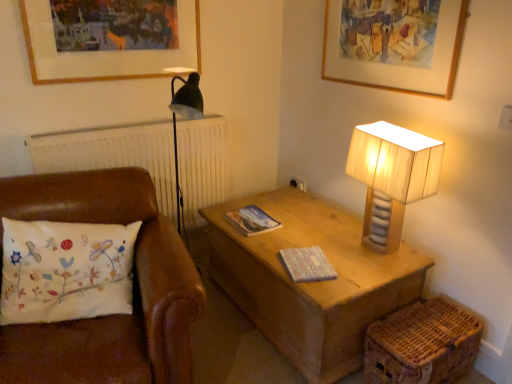
Question: From a real-world perspective, is wooden lampshade at right located higher than wooden textured book at center, the second magazine positioned from the top?

Choices:
 (A) yes
 (B) no

Answer: (A)

Question: Does wooden lampshade at right have a lesser width compared to wooden textured book at center, which ranks as the first magazine in front-to-back order?

Choices:
 (A) no
 (B) yes

Answer: (A)

Question: From the image's perspective, is wooden lampshade at right on top of wooden textured book at center, which is counted as the 2th magazine, starting from the back?

Choices:
 (A) no
 (B) yes

Answer: (B)

Question: Can you confirm if wooden lampshade at right is smaller than wooden textured book at center, which is counted as the 2th magazine, starting from the back?

Choices:
 (A) no
 (B) yes

Answer: (A)

Question: Is wooden lampshade at right taller than wooden textured book at center, placed as the first magazine when sorted from bottom to top?

Choices:
 (A) no
 (B) yes

Answer: (B)

Question: Looking at their shapes, would you say woven brown basket at lower right is wider or thinner than white embroidered pillow at left?

Choices:
 (A) thin
 (B) wide

Answer: (B)

Question: From a real-world perspective, is woven brown basket at lower right above or below white embroidered pillow at left?

Choices:
 (A) below
 (B) above

Answer: (A)

Question: Based on their sizes in the image, would you say woven brown basket at lower right is bigger or smaller than white embroidered pillow at left?

Choices:
 (A) small
 (B) big

Answer: (A)

Question: Based on their positions, is woven brown basket at lower right located to the left or right of white embroidered pillow at left?

Choices:
 (A) left
 (B) right

Answer: (B)

Question: Is wooden picture frame at upper center, the second picture frame positioned from the left, spatially inside wooden textured book at center, arranged as the 2th magazine when viewed from the left, or outside of it?

Choices:
 (A) inside
 (B) outside

Answer: (B)

Question: In terms of size, does wooden picture frame at upper center, the second picture frame positioned from the left, appear bigger or smaller than wooden textured book at center, placed as the first magazine when sorted from bottom to top?

Choices:
 (A) big
 (B) small

Answer: (A)

Question: Relative to wooden textured book at center, the second magazine positioned from the top, is wooden picture frame at upper center, marked as the first picture frame in a right-to-left arrangement, in front or behind?

Choices:
 (A) behind
 (B) front

Answer: (B)

Question: In the image, is wooden picture frame at upper center, the second picture frame positioned from the left, on the left side or the right side of wooden textured book at center, the second magazine positioned from the top?

Choices:
 (A) left
 (B) right

Answer: (B)

Question: Visually, is matte paper magazine at center, the 2th magazine in the right-to-left sequence, positioned to the left or to the right of wooden lampshade at right?

Choices:
 (A) right
 (B) left

Answer: (B)

Question: Considering the positions of point (263, 216) and point (438, 145), is point (263, 216) closer or farther from the camera than point (438, 145)?

Choices:
 (A) closer
 (B) farther

Answer: (B)